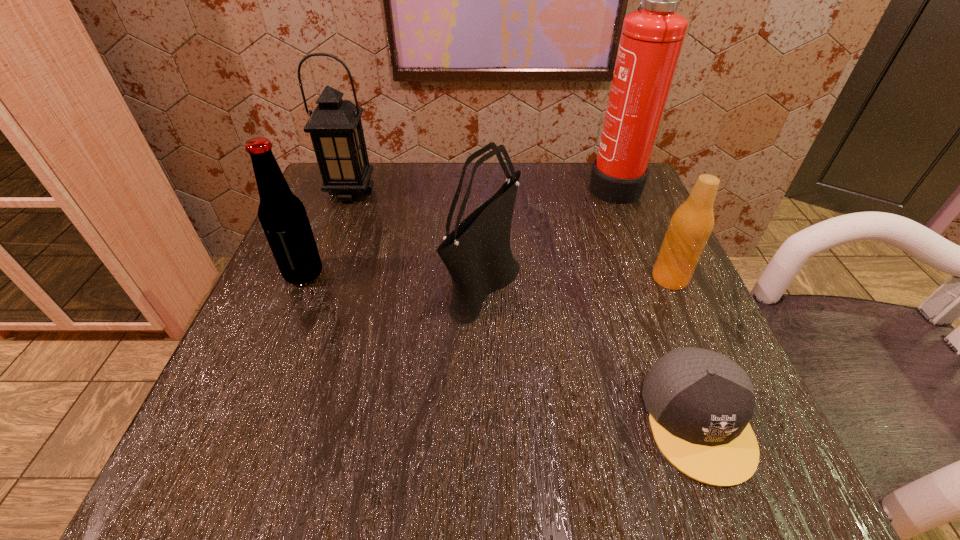
I want to click on the tallest object, so click(651, 39).

Locate an element on the screen. lantern is located at coordinates (335, 127).

At what (x,y) coordinates should I click in order to perform the action: click on the fourth object from right to left. Please return your answer as a coordinate pair (x, y). The image size is (960, 540). Looking at the image, I should click on (477, 253).

Identify the location of the left beer bottle. Image resolution: width=960 pixels, height=540 pixels. (282, 215).

You are a GUI agent. You are given a task and a screenshot of the screen. Output one action in this format:
    pyautogui.click(x=<x>, y=<y>)
    Task: Click on the right beer bottle
    The image size is (960, 540).
    Given the screenshot: What is the action you would take?
    pyautogui.click(x=691, y=225)

Find the location of a particular element. the second shortest object is located at coordinates (691, 225).

Find the location of `the nearest object`. the nearest object is located at coordinates (700, 402).

The image size is (960, 540). In order to click on the shortest object in this screenshot , I will do `click(700, 402)`.

What are the coordinates of `vacant space located 0.120m on the front-facing side of the fire extinguisher` in the screenshot? It's located at (535, 184).

This screenshot has height=540, width=960. I want to click on vacant space located on the front-facing side of the fire extinguisher, so click(422, 184).